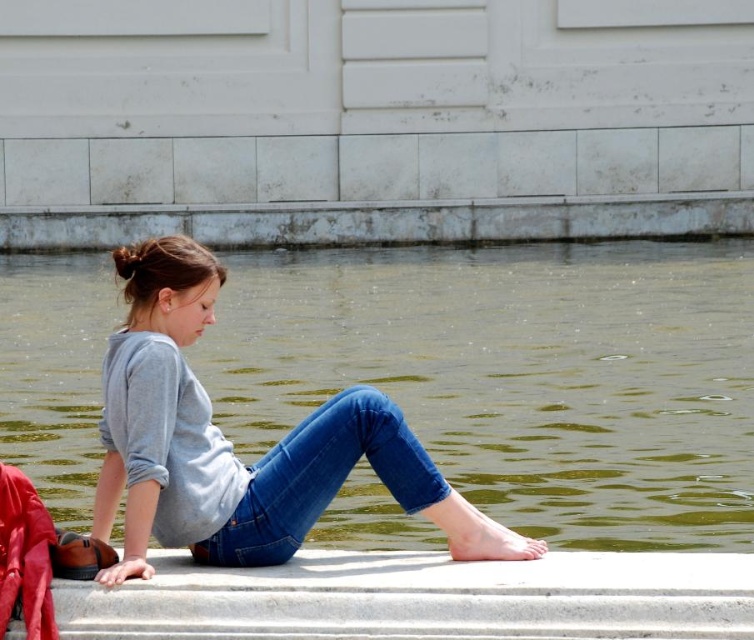
Question: Observing the image, what is the correct spatial positioning of gray concrete curb at upper center in reference to blue denim jeans at lower center?

Choices:
 (A) right
 (B) left

Answer: (B)

Question: Which object is the farthest from the blue denim jeans at lower center?

Choices:
 (A) gray cotton shirt at center
 (B) gray concrete curb at upper center

Answer: (B)

Question: Estimate the real-world distances between objects in this image. Which object is closer to the gray concrete curb at upper center?

Choices:
 (A) blue denim jeans at lower center
 (B) gray cotton shirt at center

Answer: (A)

Question: Which object is the farthest from the gray concrete curb at upper center?

Choices:
 (A) blue denim jeans at lower center
 (B) gray cotton shirt at center

Answer: (B)

Question: Is the position of gray concrete curb at upper center less distant than that of blue denim jeans at lower center?

Choices:
 (A) yes
 (B) no

Answer: (B)

Question: Observing the image, what is the correct spatial positioning of gray cotton shirt at center in reference to gray concrete curb at upper center?

Choices:
 (A) above
 (B) below

Answer: (B)